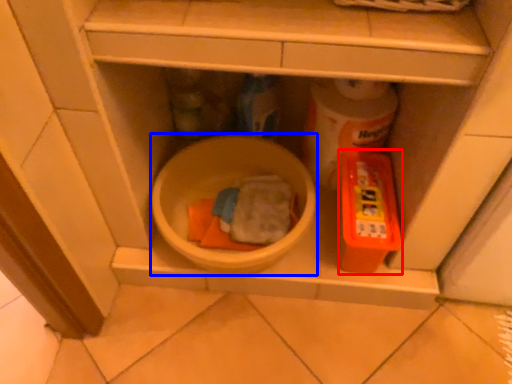
Question: Among these objects, which one is nearest to the camera, toy (highlighted by a red box) or mixing bowl (highlighted by a blue box)?

Choices:
 (A) toy
 (B) mixing bowl

Answer: (B)